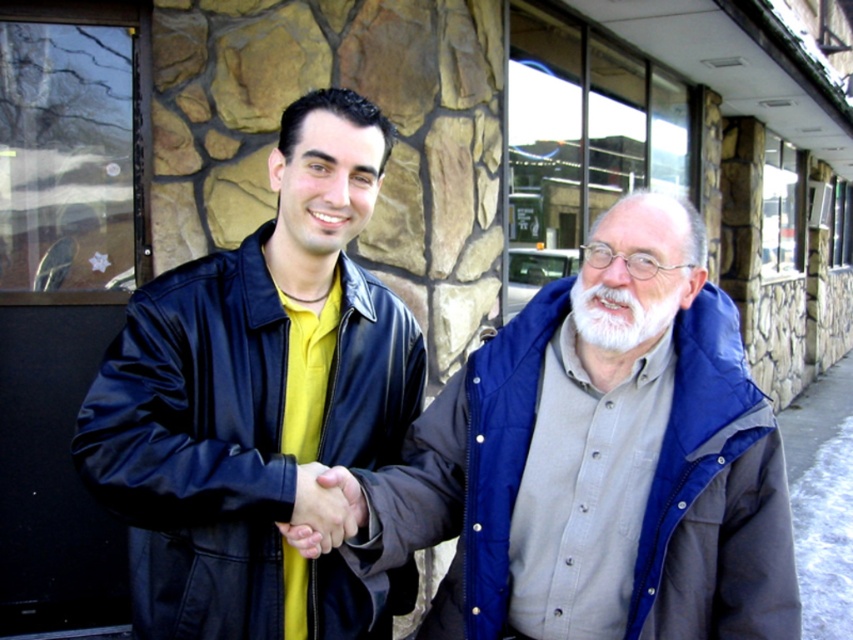
Is point (488, 556) positioned after point (624, 296)?

Yes, it is.

Is blue quilted jacket at center shorter than whitehairbeard at center?

No, blue quilted jacket at center is not shorter than whitehairbeard at center.

Describe the element at coordinates (715, 499) in the screenshot. I see `blue quilted jacket at center` at that location.

Where is `blue quilted jacket at center`? blue quilted jacket at center is located at coordinates (715, 499).

Find the location of a particular element. This screenshot has width=853, height=640. gray concrete pavement at lower right is located at coordinates (822, 499).

Between point (834, 554) and point (579, 308), which one is positioned behind?

Positioned behind is point (834, 554).

The image size is (853, 640). I want to click on gray concrete pavement at lower right, so coord(822,499).

Looking at this image, how distant is blue quilted jacket at center from smooth leather hand at center?

blue quilted jacket at center and smooth leather hand at center are 13.42 inches apart.

Does point (547, 328) lie behind point (341, 512)?

Yes, it is.

The height and width of the screenshot is (640, 853). Describe the element at coordinates (715, 499) in the screenshot. I see `blue quilted jacket at center` at that location.

Find the location of `blue quilted jacket at center`. blue quilted jacket at center is located at coordinates pos(715,499).